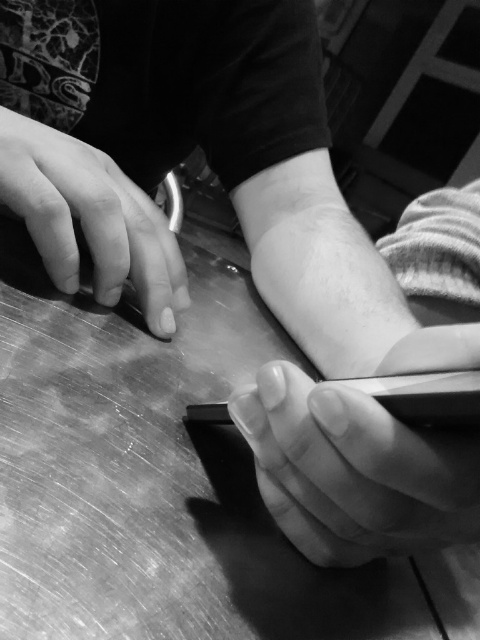
Question: Can you confirm if metallic polished table at center is positioned above smooth skin at lower right?

Choices:
 (A) no
 (B) yes

Answer: (B)

Question: Which point is closer to the camera?

Choices:
 (A) smooth skin at left
 (B) metallic polished table at center

Answer: (B)

Question: Considering the real-world distances, which object is farthest from the metallic polished table at center?

Choices:
 (A) smooth skin at left
 (B) smooth skin at lower right

Answer: (B)

Question: Where is smooth skin at lower right located in relation to smooth skin at left in the image?

Choices:
 (A) below
 (B) above

Answer: (A)

Question: Among these objects, which one is farthest from the camera?

Choices:
 (A) smooth skin at left
 (B) metallic polished table at center

Answer: (A)

Question: Is smooth skin at lower right above smooth skin at left?

Choices:
 (A) yes
 (B) no

Answer: (B)